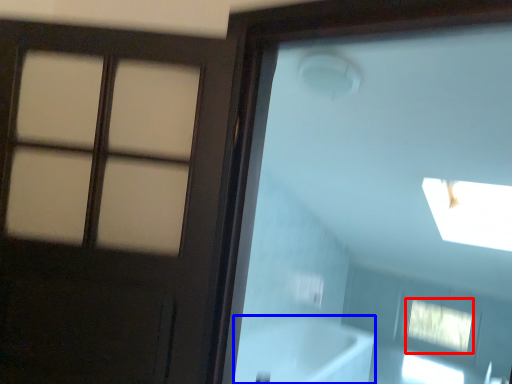
Question: Among these objects, which one is nearest to the camera, window (highlighted by a red box) or bath (highlighted by a blue box)?

Choices:
 (A) window
 (B) bath

Answer: (B)